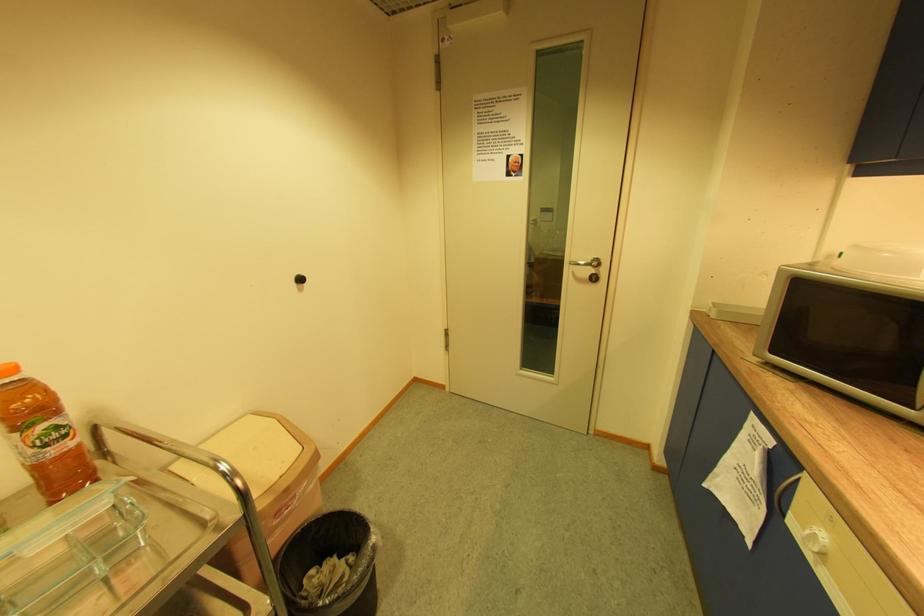
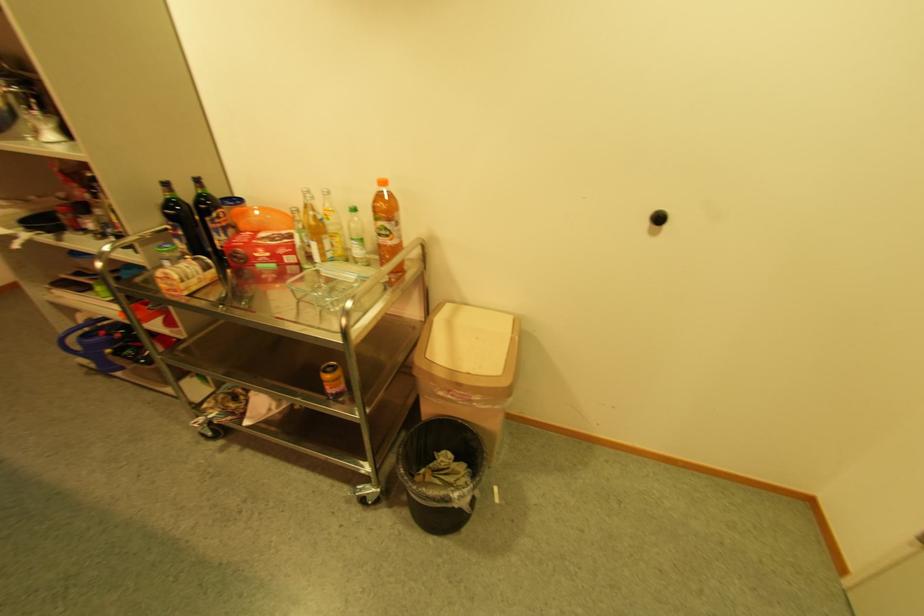
The images are taken continuously from a first-person perspective. In which direction is your viewpoint rotating?

The camera's rotation is toward left-down.